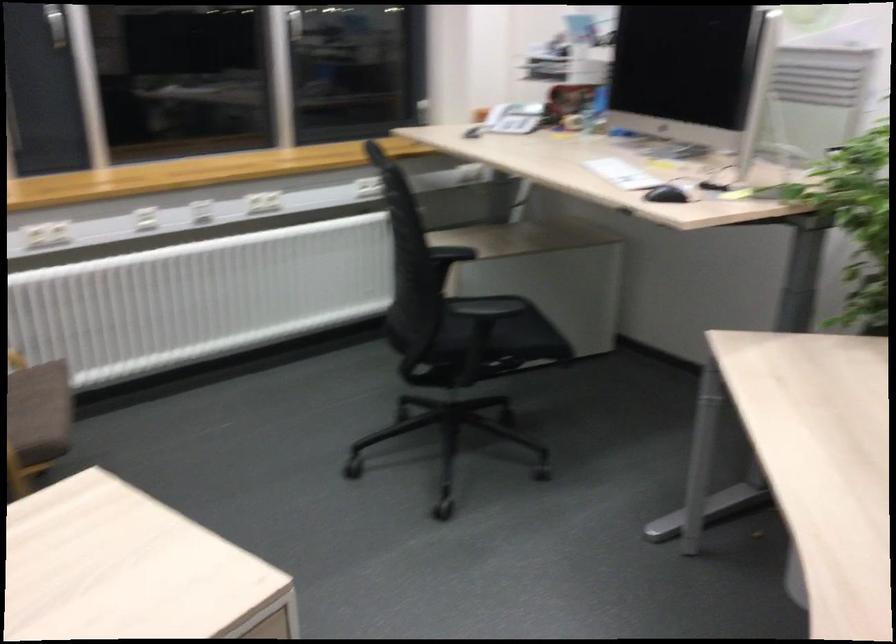
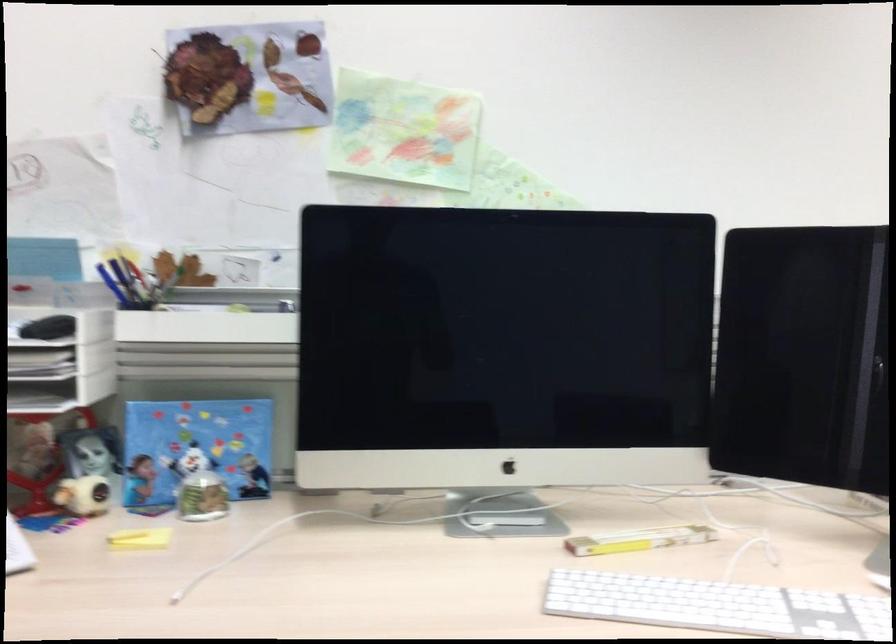
Where in the second image is the point corresponding to (x=607, y=126) from the first image?

(202, 497)